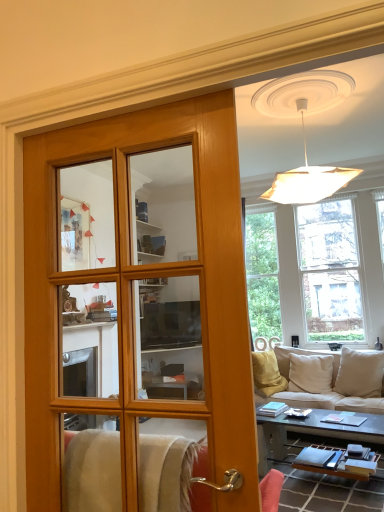
Question: Considering the relative sizes of wooden door at center and beige fabric couch at lower right in the image provided, is wooden door at center shorter than beige fabric couch at lower right?

Choices:
 (A) no
 (B) yes

Answer: (A)

Question: From a real-world perspective, is wooden door at center physically above beige fabric couch at lower right?

Choices:
 (A) yes
 (B) no

Answer: (A)

Question: Is wooden door at center closer to camera compared to beige fabric couch at lower right?

Choices:
 (A) no
 (B) yes

Answer: (B)

Question: Is wooden door at center to the right of beige fabric couch at lower right from the viewer's perspective?

Choices:
 (A) no
 (B) yes

Answer: (A)

Question: Can you confirm if wooden door at center is thinner than beige fabric couch at lower right?

Choices:
 (A) no
 (B) yes

Answer: (B)

Question: From the image's perspective, is wooden door at center on beige fabric couch at lower right?

Choices:
 (A) yes
 (B) no

Answer: (A)

Question: Is beige fabric couch at lower right at the right side of clear glass window at upper right?

Choices:
 (A) no
 (B) yes

Answer: (A)

Question: Would you say beige fabric couch at lower right is outside clear glass window at upper right?

Choices:
 (A) yes
 (B) no

Answer: (A)

Question: Considering the relative sizes of beige fabric couch at lower right and clear glass window at upper right in the image provided, is beige fabric couch at lower right thinner than clear glass window at upper right?

Choices:
 (A) no
 (B) yes

Answer: (A)

Question: Is beige fabric couch at lower right behind clear glass window at upper right?

Choices:
 (A) no
 (B) yes

Answer: (A)

Question: Can clear glass window at upper right be found inside beige fabric couch at lower right?

Choices:
 (A) yes
 (B) no

Answer: (B)

Question: Considering the relative sizes of beige fabric couch at lower right and clear glass window at upper right in the image provided, is beige fabric couch at lower right bigger than clear glass window at upper right?

Choices:
 (A) yes
 (B) no

Answer: (B)

Question: Is the position of clear glass window at upper right more distant than that of wooden door at center?

Choices:
 (A) no
 (B) yes

Answer: (B)